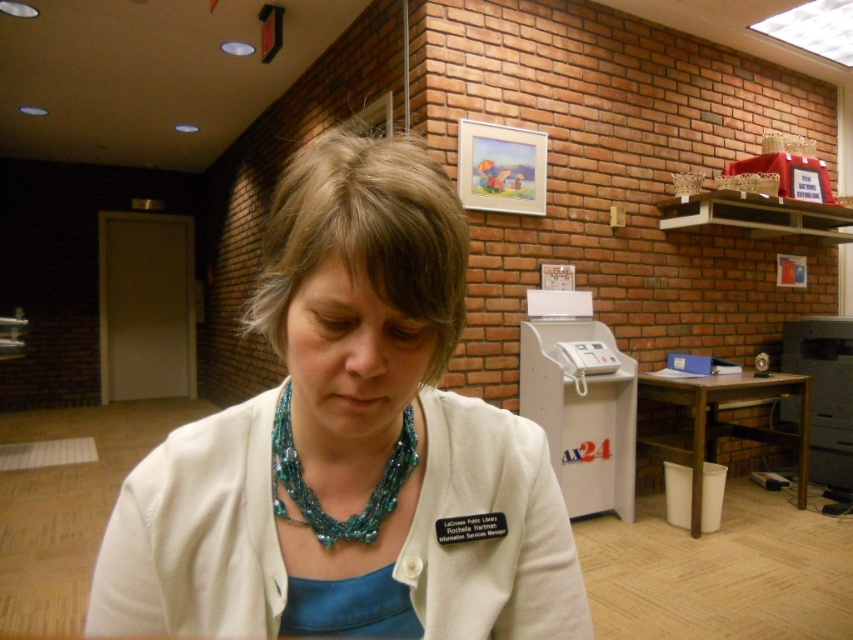
Does point (807, 404) come behind point (339, 524)?

Yes, it is behind point (339, 524).

Does point (751, 394) come farther from viewer compared to point (397, 444)?

Yes.

This screenshot has height=640, width=853. Identify the location of brown wooden table at lower right. (723, 422).

Which is behind, point (350, 536) or point (360, 518)?

The point (360, 518) is behind.

Who is more forward, (509, 554) or (399, 481)?

Point (399, 481) is in front.

The width and height of the screenshot is (853, 640). Identify the location of white fabric jacket at center. (349, 445).

Can you confirm if white fabric jacket at center is positioned to the right of brown wooden table at lower right?

In fact, white fabric jacket at center is to the left of brown wooden table at lower right.

Is the position of white fabric jacket at center less distant than that of brown wooden table at lower right?

Yes.

In order to click on white fabric jacket at center in this screenshot , I will do 349,445.

Find the location of a particular element. This screenshot has height=640, width=853. white fabric jacket at center is located at coordinates (349, 445).